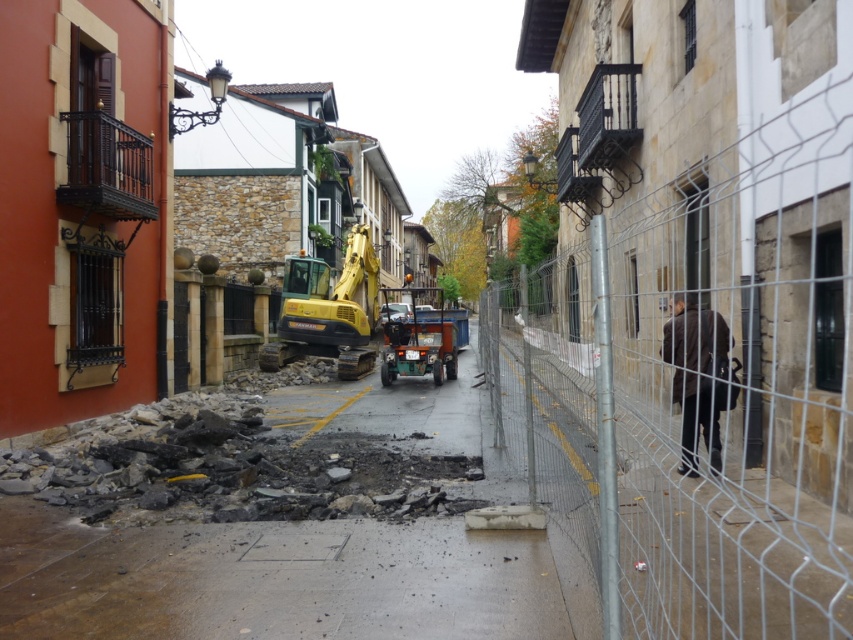
From the picture: You are a delivery person who needs to place a dark brown leather jacket at right and a green rubber utility vehicle at center in a storage area. The storage area has a width of 12 feet. Can both items be placed side by side without overlapping?

The dark brown leather jacket at right and green rubber utility vehicle at center are 42.91 feet apart. Since the storage area is only 12 feet wide, they cannot be placed side by side without overlapping as the required space exceeds the available width.

You are standing at the point labeled as point (700, 387) in the image. What object is directly to your right?

The wire mesh fence at right is directly to your right.